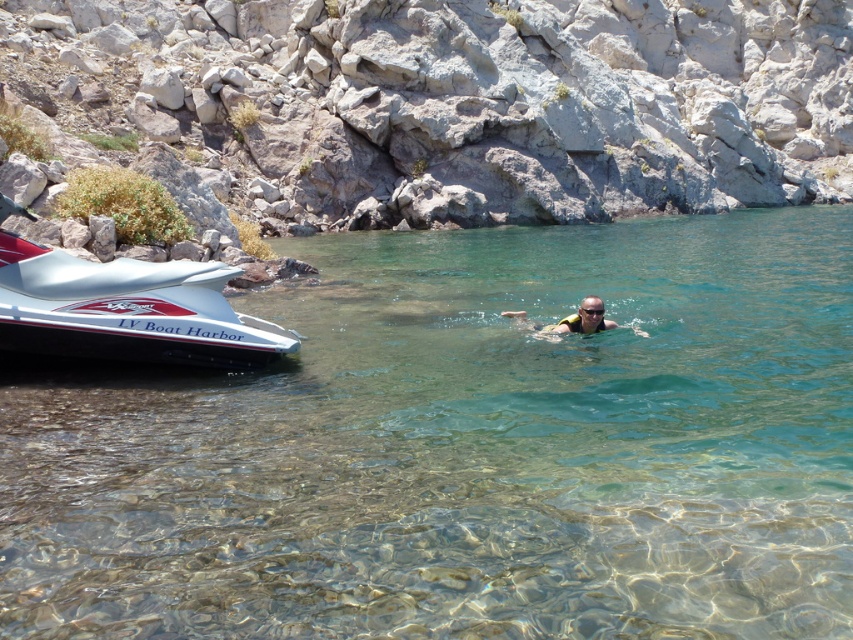
Question: Is gray rock at upper center to the right of tan skin swimmer at center from the viewer's perspective?

Choices:
 (A) yes
 (B) no

Answer: (A)

Question: Based on their relative distances, which object is farther from the clear water at center?

Choices:
 (A) gray rock at upper center
 (B) silver metallic speedboat at left
 (C) transparent plastic goggles at center

Answer: (A)

Question: Estimate the real-world distances between objects in this image. Which object is closer to the silver metallic speedboat at left?

Choices:
 (A) gray rock at upper center
 (B) tan skin swimmer at center

Answer: (B)

Question: Is gray rock at upper center to the right of silver metallic speedboat at left from the viewer's perspective?

Choices:
 (A) yes
 (B) no

Answer: (A)

Question: Can you confirm if clear water at center is positioned to the left of gray rock at upper center?

Choices:
 (A) yes
 (B) no

Answer: (A)

Question: Which of the following is the farthest from the observer?

Choices:
 (A) (422, 256)
 (B) (38, 305)

Answer: (A)